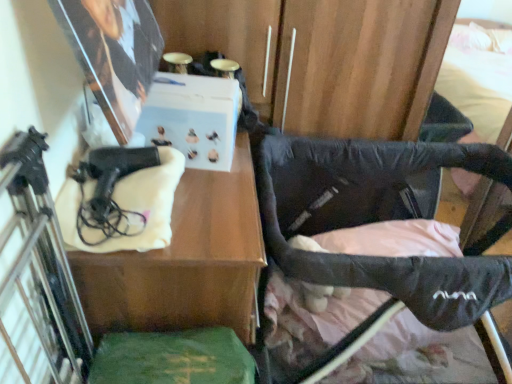
Question: Can you see black fabric stroller at lower right touching matte black hairdryer at left?

Choices:
 (A) yes
 (B) no

Answer: (B)

Question: Are black fabric stroller at lower right and matte black hairdryer at left located far from each other?

Choices:
 (A) no
 (B) yes

Answer: (A)

Question: From a real-world perspective, does black fabric stroller at lower right sit lower than matte black hairdryer at left?

Choices:
 (A) no
 (B) yes

Answer: (B)

Question: Does black fabric stroller at lower right appear on the right side of matte black hairdryer at left?

Choices:
 (A) yes
 (B) no

Answer: (A)

Question: Is black fabric stroller at lower right positioned behind matte black hairdryer at left?

Choices:
 (A) no
 (B) yes

Answer: (B)

Question: Can you confirm if black fabric stroller at lower right is bigger than matte black hairdryer at left?

Choices:
 (A) no
 (B) yes

Answer: (B)

Question: Does black fabric stroller at lower right come behind black matte gun at left?

Choices:
 (A) no
 (B) yes

Answer: (B)

Question: Considering the relative sizes of black fabric stroller at lower right and black matte gun at left in the image provided, is black fabric stroller at lower right thinner than black matte gun at left?

Choices:
 (A) no
 (B) yes

Answer: (A)

Question: Would you say black matte gun at left is part of black fabric stroller at lower right's contents?

Choices:
 (A) no
 (B) yes

Answer: (A)

Question: From the image's perspective, is black fabric stroller at lower right below black matte gun at left?

Choices:
 (A) yes
 (B) no

Answer: (A)

Question: Is black fabric stroller at lower right smaller than black matte gun at left?

Choices:
 (A) no
 (B) yes

Answer: (A)

Question: Is black fabric stroller at lower right turned away from black matte gun at left?

Choices:
 (A) no
 (B) yes

Answer: (A)

Question: Is black matte gun at left surrounding black fabric stroller at lower right?

Choices:
 (A) no
 (B) yes

Answer: (A)